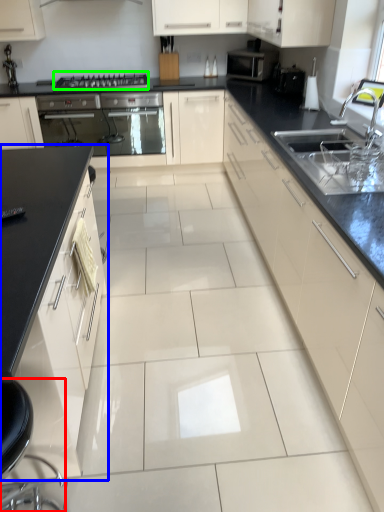
Question: Which object is the closest to the swivel chair (highlighted by a red box)? Choose among these: cabinetry (highlighted by a blue box) or gas stove (highlighted by a green box).

Choices:
 (A) cabinetry
 (B) gas stove

Answer: (A)